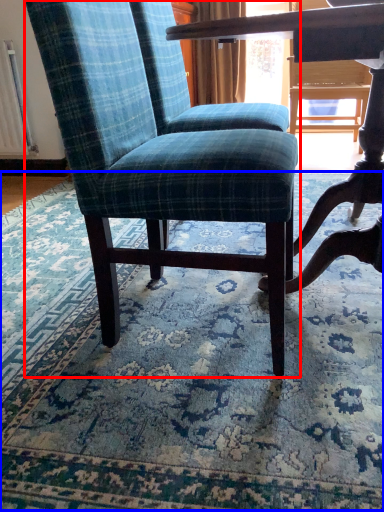
Question: Which point is further to the camera, chair (highlighted by a red box) or mat (highlighted by a blue box)?

Choices:
 (A) chair
 (B) mat

Answer: (A)